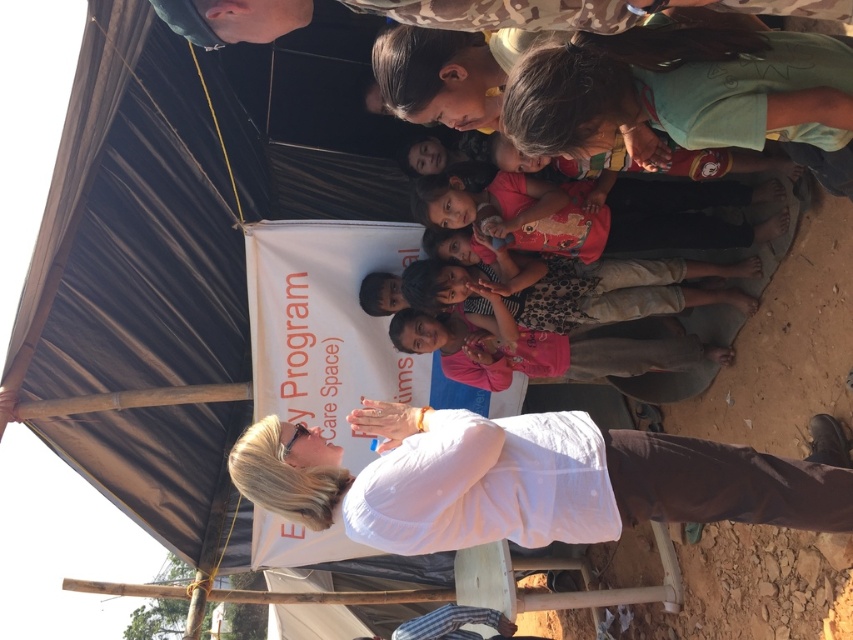
Question: Can you confirm if matte pink shirt at center is bigger than light brown cotton pants at center?

Choices:
 (A) no
 (B) yes

Answer: (B)

Question: Can you confirm if light brown cotton pants at center is smaller than camouflage fabric at upper center?

Choices:
 (A) yes
 (B) no

Answer: (B)

Question: Does white matte shirt at lower center have a larger size compared to pink fabric shirt at center?

Choices:
 (A) yes
 (B) no

Answer: (A)

Question: Which point is farther to the camera?

Choices:
 (A) pink fabric shirt at center
 (B) light brown cotton pants at center
 (C) matte pink shirt at center
 (D) white matte shirt at lower center

Answer: (A)

Question: Among these objects, which one is farthest from the camera?

Choices:
 (A) white matte shirt at lower center
 (B) pink fabric shirt at center

Answer: (B)

Question: Among these objects, which one is farthest from the camera?

Choices:
 (A) white matte shirt at lower center
 (B) light brown cotton pants at center

Answer: (B)